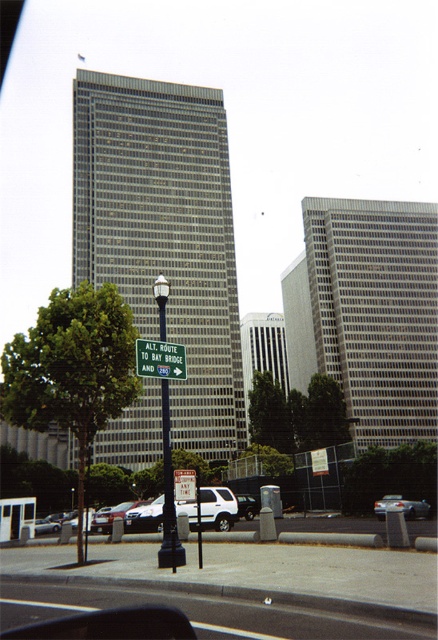
Question: Which of the following is the closest to the observer?

Choices:
 (A) white matte car window at center
 (B) silver metallic sedan at center
 (C) black metal pole at center
 (D) white matte suv at center

Answer: (C)

Question: Does green plastic sign at center appear on the left side of silver metallic sedan at center?

Choices:
 (A) yes
 (B) no

Answer: (B)

Question: Which point is farther to the camera?

Choices:
 (A) (172, 556)
 (B) (49, 532)

Answer: (B)

Question: Is silver metallic sedan at center positioned behind white matte car window at center?

Choices:
 (A) no
 (B) yes

Answer: (B)

Question: Is green plastic sign at center wider than silver metallic sedan at center?

Choices:
 (A) no
 (B) yes

Answer: (A)

Question: Among these objects, which one is nearest to the camera?

Choices:
 (A) white matte car window at center
 (B) green plastic sign at center

Answer: (B)